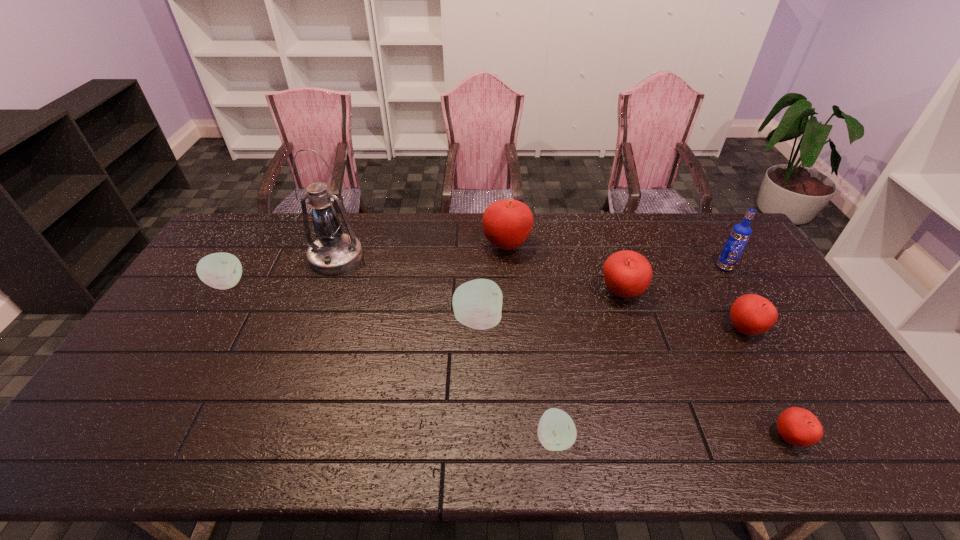
Where is `the leftmost object`? Image resolution: width=960 pixels, height=540 pixels. the leftmost object is located at coordinates (222, 270).

In order to click on the second biggest white apple in this screenshot , I will do `click(222, 270)`.

Identify the location of the second smallest red apple. The width and height of the screenshot is (960, 540). (751, 314).

Locate an element on the screen. This screenshot has height=540, width=960. the smallest white apple is located at coordinates (556, 431).

Where is `the nearest white apple`? The width and height of the screenshot is (960, 540). the nearest white apple is located at coordinates (556, 431).

Identify the location of the nearest red apple. (797, 426).

The width and height of the screenshot is (960, 540). In order to click on free location located on the front of the eighth object from right to left in this screenshot , I will do `click(310, 329)`.

Identify the location of free space located 0.150m on the left of the second tallest object. (671, 267).

The width and height of the screenshot is (960, 540). Identify the location of vacant space positioned 0.250m on the left of the seventh shortest object. (412, 245).

In order to click on free region located on the left of the second white apple from right to left in this screenshot , I will do `click(380, 321)`.